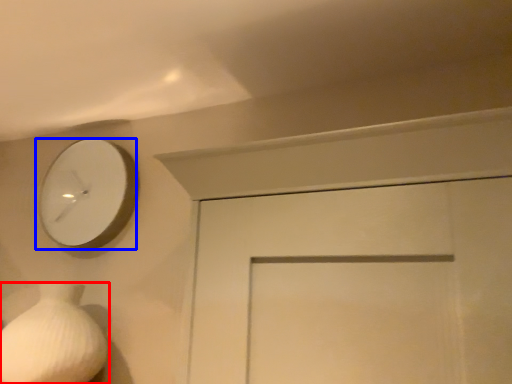
Question: Which point is closer to the camera, vase (highlighted by a red box) or wall clock (highlighted by a blue box)?

Choices:
 (A) vase
 (B) wall clock

Answer: (A)